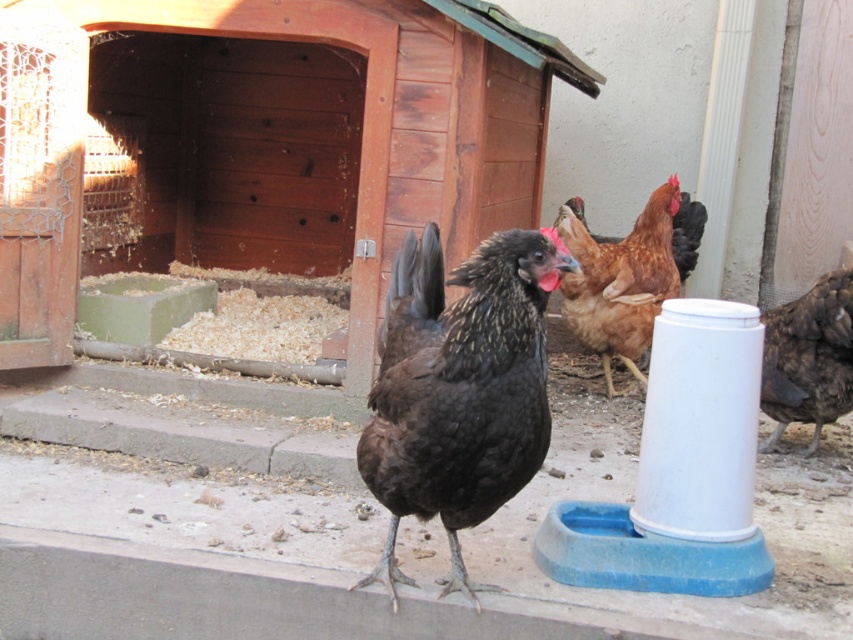
Question: Can you confirm if shiny black chicken at center is positioned below shiny black feathers at center?

Choices:
 (A) no
 (B) yes

Answer: (B)

Question: Does shiny black chicken at center appear on the left side of dark brown feathers at right?

Choices:
 (A) yes
 (B) no

Answer: (A)

Question: Is wooden coop at center further to camera compared to brown feathered chicken at center?

Choices:
 (A) yes
 (B) no

Answer: (A)

Question: Which point is closer to the camera taking this photo?

Choices:
 (A) (836, 355)
 (B) (433, 316)

Answer: (B)

Question: Among these points, which one is nearest to the camera?

Choices:
 (A) (804, 392)
 (B) (624, 264)

Answer: (A)

Question: Which object appears farthest from the camera in this image?

Choices:
 (A) shiny black chicken at center
 (B) dark brown feathers at right

Answer: (B)